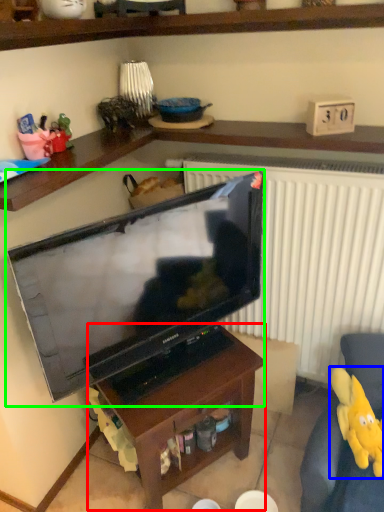
Question: Considering the real-world distances, which object is closest to table (highlighted by a red box)? toy (highlighted by a blue box) or television (highlighted by a green box).

Choices:
 (A) toy
 (B) television

Answer: (B)